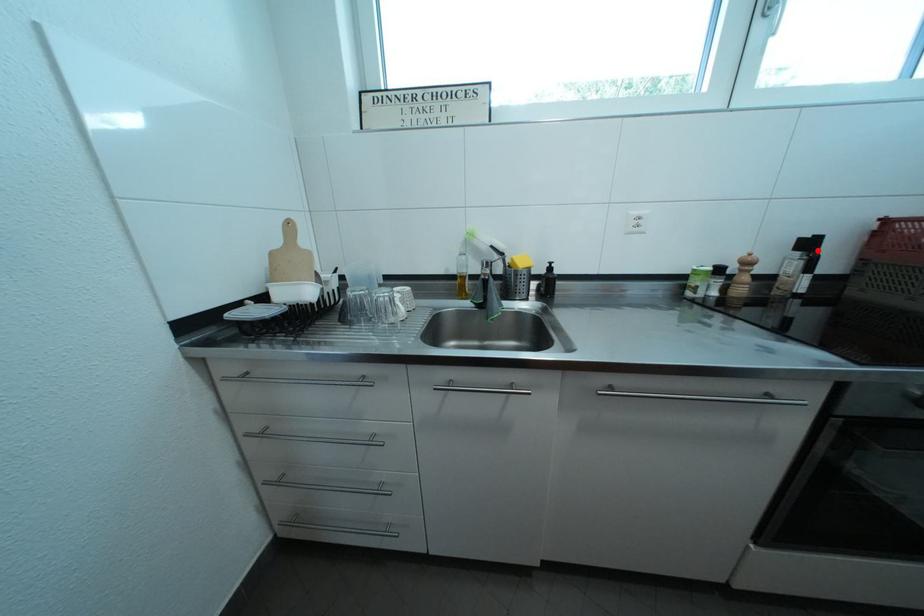
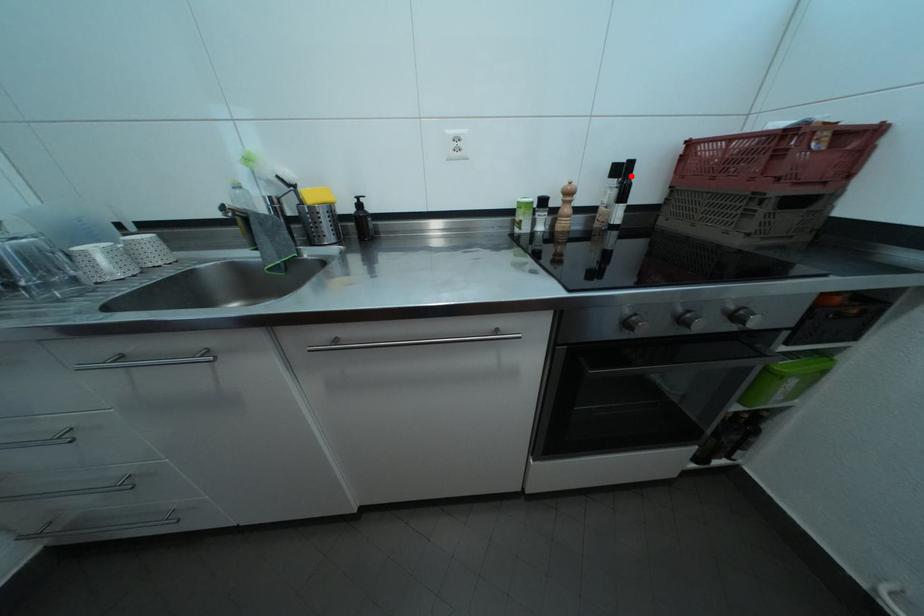
I am providing you with two images of the same scene from different viewpoints. A red point is marked on the first image and another point is marked on the second image. Does the point marked in image1 correspond to the same location as the one in image2?

Yes